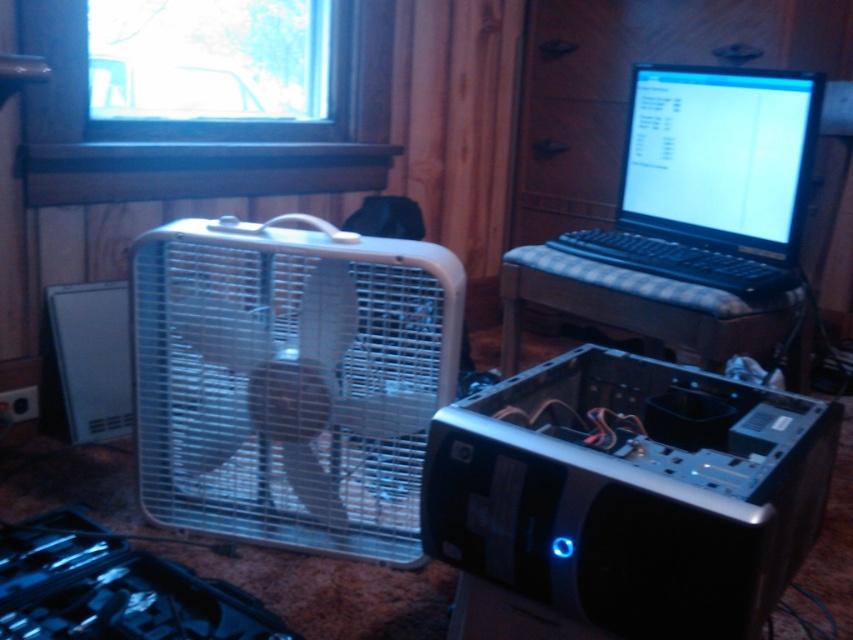
Question: Among these points, which one is farthest from the camera?

Choices:
 (A) (679, 259)
 (B) (538, 276)
 (C) (254, 392)

Answer: (B)

Question: Where is metallic silver fan at left located in relation to black plastic laptop at upper right in the image?

Choices:
 (A) above
 (B) below

Answer: (B)

Question: Which point is closer to the camera?

Choices:
 (A) black plastic computer case at center
 (B) black plastic laptop at upper right

Answer: (A)

Question: Does metallic silver fan at left have a larger size compared to plaid fabric keyboard at center?

Choices:
 (A) no
 (B) yes

Answer: (A)

Question: Can you confirm if black plastic computer case at center is positioned above black plastic laptop at upper right?

Choices:
 (A) no
 (B) yes

Answer: (A)

Question: Considering the real-world distances, which object is farthest from the black plastic computer case at center?

Choices:
 (A) metallic silver fan at left
 (B) black plastic laptop at upper right

Answer: (B)